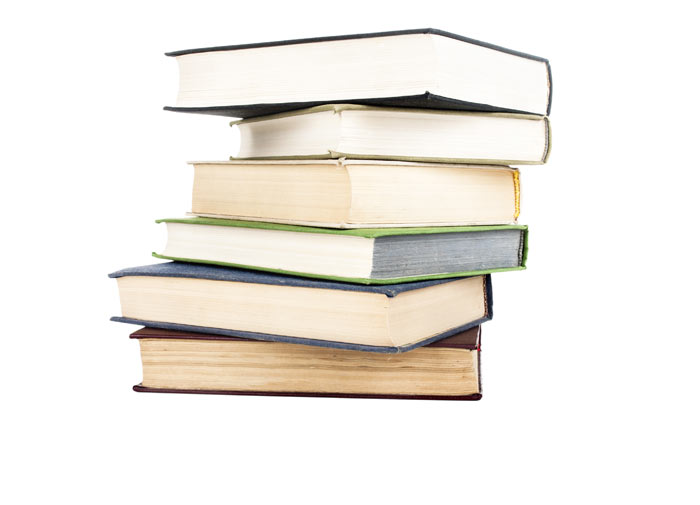
This screenshot has height=505, width=700. I want to click on books, so click(x=369, y=70), click(x=360, y=136), click(x=379, y=195), click(x=336, y=258), click(x=316, y=308), click(x=298, y=371).